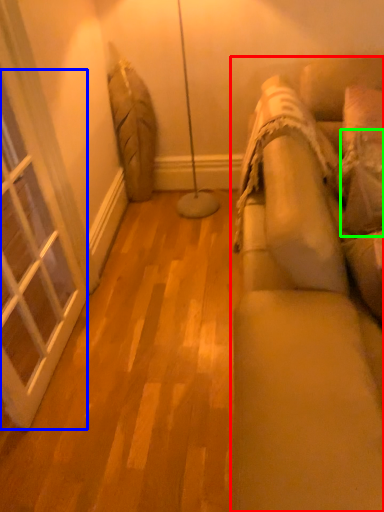
Question: Which object is positioned farthest from studio couch (highlighted by a red box)? Select from window (highlighted by a blue box) and pillow (highlighted by a green box).

Choices:
 (A) window
 (B) pillow

Answer: (A)